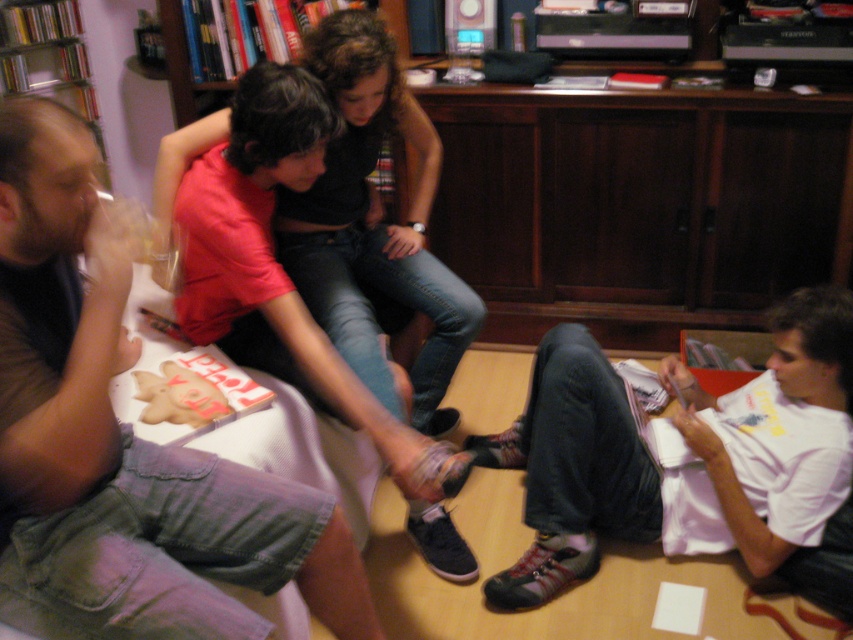
Question: Observing the image, what is the correct spatial positioning of denim shorts at left in reference to white fabric shirt at lower right?

Choices:
 (A) right
 (B) left

Answer: (B)

Question: Is denim shorts at left below white fabric shirt at lower right?

Choices:
 (A) yes
 (B) no

Answer: (B)

Question: Among these objects, which one is farthest from the camera?

Choices:
 (A) matte red shirt at center
 (B) white fabric shirt at lower right

Answer: (B)

Question: Based on their relative distances, which object is farther from the denim shorts at left?

Choices:
 (A) matte red shirt at center
 (B) white fabric shirt at lower right

Answer: (B)

Question: Does denim shorts at left appear under matte red shirt at center?

Choices:
 (A) yes
 (B) no

Answer: (A)

Question: Considering the real-world distances, which object is farthest from the white fabric shirt at lower right?

Choices:
 (A) matte red shirt at center
 (B) denim shorts at left

Answer: (B)